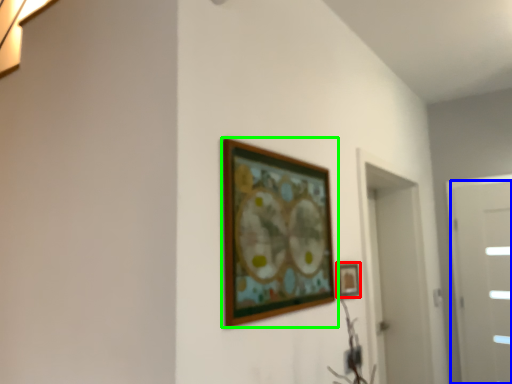
Question: Which object is the farthest from picture frame (highlighted by a red box)? Choose among these: door (highlighted by a blue box) or picture frame (highlighted by a green box).

Choices:
 (A) door
 (B) picture frame

Answer: (A)